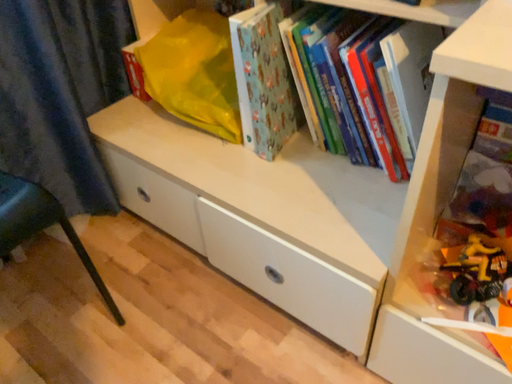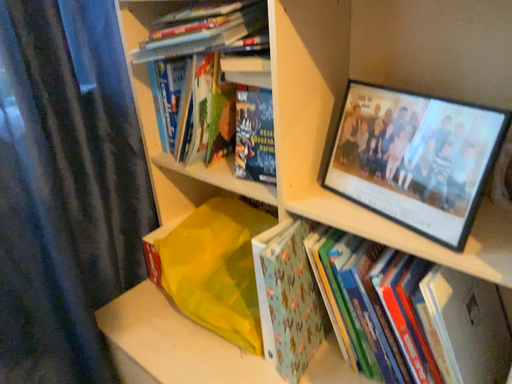
Question: How did the camera likely rotate when shooting the video?

Choices:
 (A) rotated upward
 (B) rotated downward

Answer: (A)